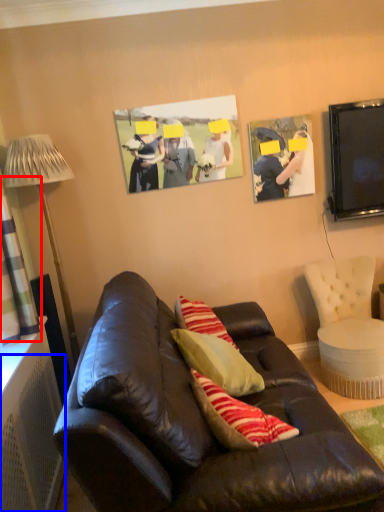
Question: Which object appears farthest to the camera in this image, curtain (highlighted by a red box) or radiator (highlighted by a blue box)?

Choices:
 (A) curtain
 (B) radiator

Answer: (A)